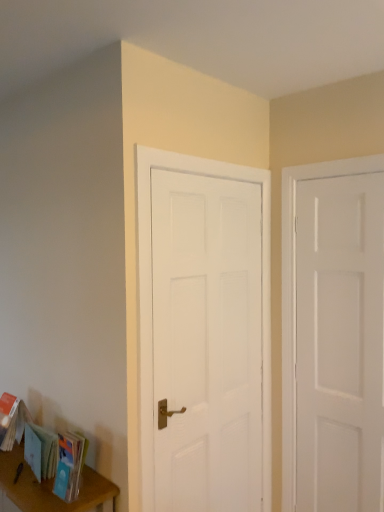
Question: Is white matte door at center, positioned as the 2th door in right-to-left order, placed right next to light blue paper book at lower left?

Choices:
 (A) yes
 (B) no

Answer: (B)

Question: Can you confirm if white matte door at center, which appears as the first door when viewed from the left, is positioned to the right of light blue paper book at lower left?

Choices:
 (A) no
 (B) yes

Answer: (B)

Question: Is light blue paper book at lower left at the back of white matte door at center, positioned as the 2th door in right-to-left order?

Choices:
 (A) yes
 (B) no

Answer: (B)

Question: From the image's perspective, is white matte door at center, positioned as the 2th door in right-to-left order, located above light blue paper book at lower left?

Choices:
 (A) no
 (B) yes

Answer: (B)

Question: Considering the relative positions of white matte door at center, which appears as the first door when viewed from the left, and light blue paper book at lower left in the image provided, is white matte door at center, which appears as the first door when viewed from the left, to the left of light blue paper book at lower left from the viewer's perspective?

Choices:
 (A) yes
 (B) no

Answer: (B)

Question: From a real-world perspective, is light blue paper book at lower left positioned above or below white matte door at right, the 2th door in the left-to-right sequence?

Choices:
 (A) above
 (B) below

Answer: (B)

Question: From their relative heights in the image, would you say light blue paper book at lower left is taller or shorter than white matte door at right, the first door positioned from the right?

Choices:
 (A) short
 (B) tall

Answer: (A)

Question: From the image's perspective, relative to white matte door at right, the first door positioned from the right, is light blue paper book at lower left above or below?

Choices:
 (A) above
 (B) below

Answer: (B)

Question: Is light blue paper book at lower left situated inside white matte door at right, the 2th door in the left-to-right sequence, or outside?

Choices:
 (A) outside
 (B) inside

Answer: (A)

Question: Based on their sizes in the image, would you say matte blue paperback book at lower left is bigger or smaller than white matte door at right, the 2th door in the left-to-right sequence?

Choices:
 (A) big
 (B) small

Answer: (B)

Question: Would you say matte blue paperback book at lower left is to the left or to the right of white matte door at right, the first door positioned from the right, in the picture?

Choices:
 (A) left
 (B) right

Answer: (A)

Question: Is matte blue paperback book at lower left wider or thinner than white matte door at right, the 2th door in the left-to-right sequence?

Choices:
 (A) thin
 (B) wide

Answer: (B)

Question: Is point (61, 463) positioned closer to the camera than point (314, 209)?

Choices:
 (A) farther
 (B) closer

Answer: (B)

Question: Is point (x=342, y=423) positioned closer to the camera than point (x=67, y=433)?

Choices:
 (A) farther
 (B) closer

Answer: (A)

Question: Considering the positions of white matte door at right, the 2th door in the left-to-right sequence, and matte blue paperback book at lower left in the image, is white matte door at right, the 2th door in the left-to-right sequence, taller or shorter than matte blue paperback book at lower left?

Choices:
 (A) tall
 (B) short

Answer: (A)